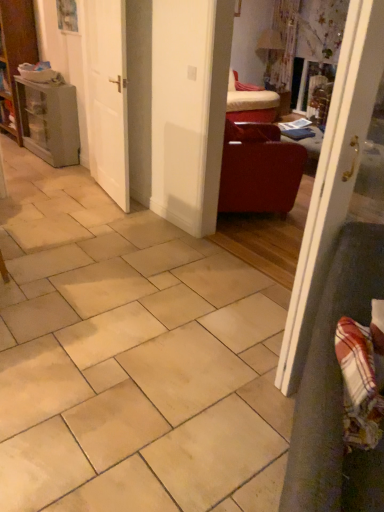
The width and height of the screenshot is (384, 512). I want to click on free spot to the left of white glossy door at right, placed as the 1th door when sorted from right to left, so (x=238, y=362).